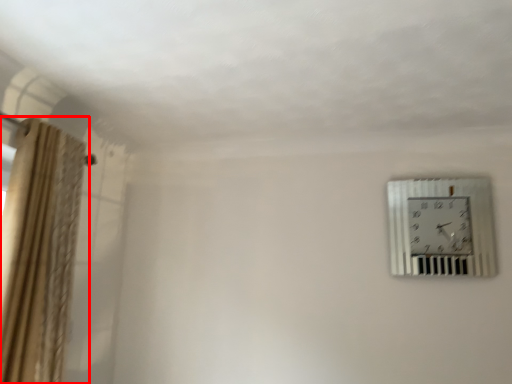
Question: In this image, where is curtain (annotated by the red box) located relative to wall clock?

Choices:
 (A) right
 (B) left

Answer: (B)